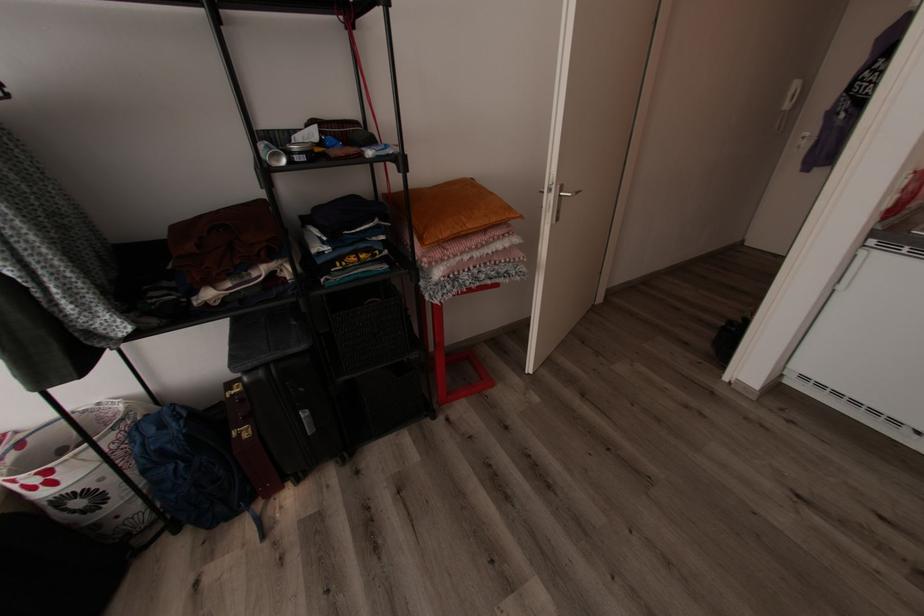
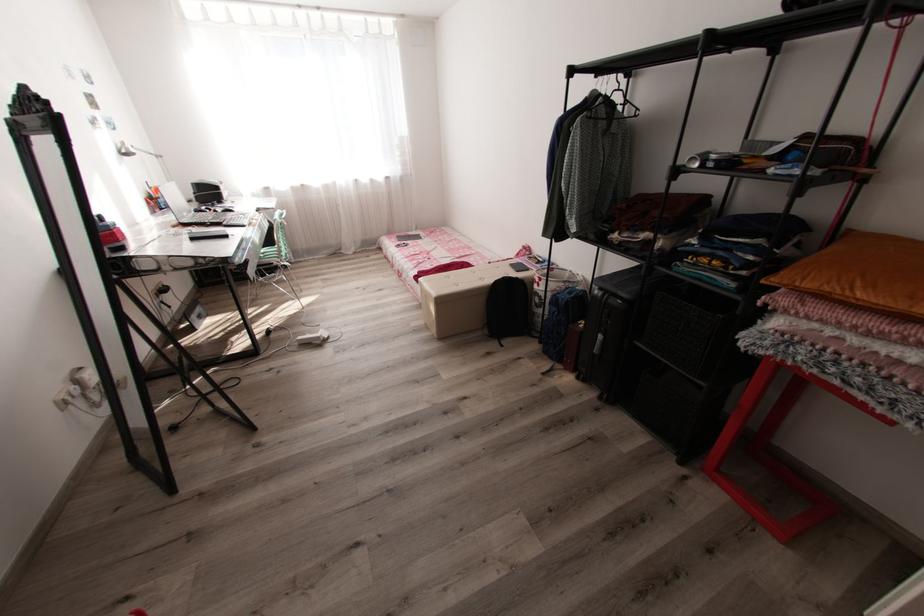
The point at (309, 413) is marked in the first image. Where is the corresponding point in the second image?

(603, 336)